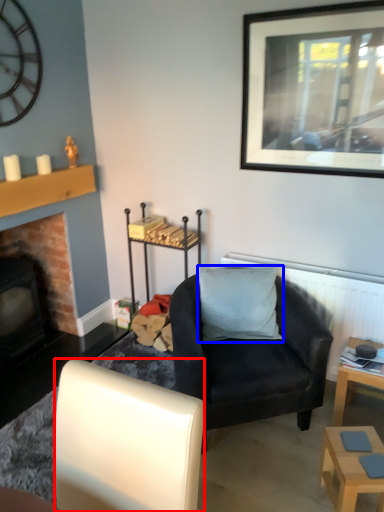
Question: Among these objects, which one is nearest to the camera, chair (highlighted by a red box) or pillow (highlighted by a blue box)?

Choices:
 (A) chair
 (B) pillow

Answer: (A)